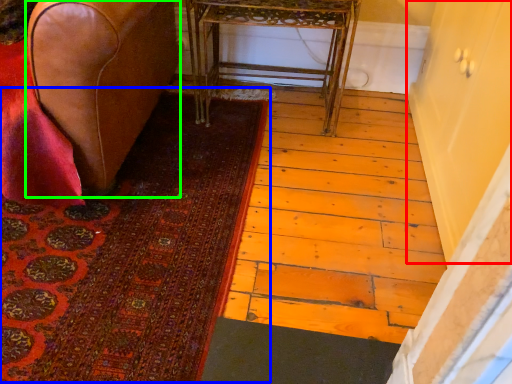
Question: Based on their relative distances, which object is nearer to screen door (highlighted by a red box)? Choose from mat (highlighted by a blue box) and furniture (highlighted by a green box).

Choices:
 (A) mat
 (B) furniture

Answer: (A)